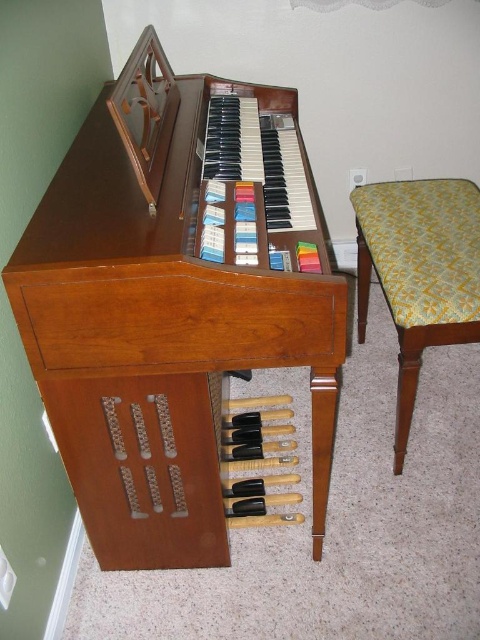
In the scene shown: Between wooden drawer at lower center and yellow-green fabric cushion at right, which one is positioned higher?

yellow-green fabric cushion at right

Locate an element on the screen. wooden drawer at lower center is located at coordinates (142, 467).

Does wooden piano at center appear under yellow-green fabric cushion at right?

No, wooden piano at center is not below yellow-green fabric cushion at right.

Does wooden piano at center have a smaller size compared to yellow-green fabric cushion at right?

No.

Does point (168, 486) lie in front of point (430, 256)?

Yes.

Image resolution: width=480 pixels, height=640 pixels. What are the coordinates of `wooden piano at center` in the screenshot? It's located at coord(176,305).

Is wooden piano at center wider than wooden drawer at lower center?

Indeed, wooden piano at center has a greater width compared to wooden drawer at lower center.

Is point (217, 444) positioned in front of point (94, 436)?

That is False.

The height and width of the screenshot is (640, 480). Describe the element at coordinates (176, 305) in the screenshot. I see `wooden piano at center` at that location.

Where is `wooden piano at center`? The width and height of the screenshot is (480, 640). wooden piano at center is located at coordinates (176, 305).